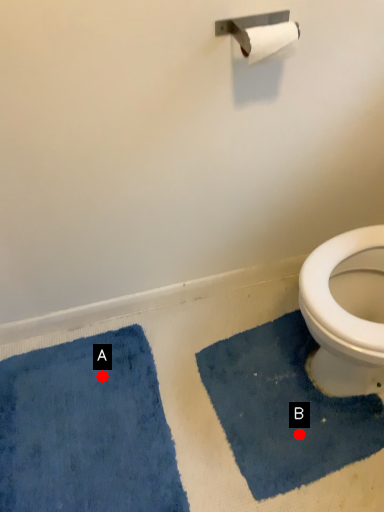
Question: Two points are circled on the image, labeled by A and B beside each circle. Which point appears farthest from the camera in this image?

Choices:
 (A) A is further
 (B) B is further

Answer: (A)